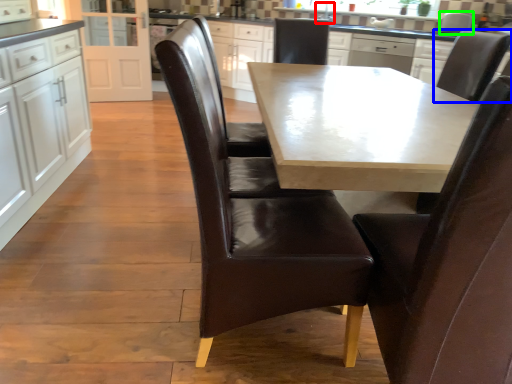
Question: Considering the real-world distances, which object is closest to sink (highlighted by a red box)? chair (highlighted by a blue box) or appliance (highlighted by a green box).

Choices:
 (A) chair
 (B) appliance

Answer: (B)